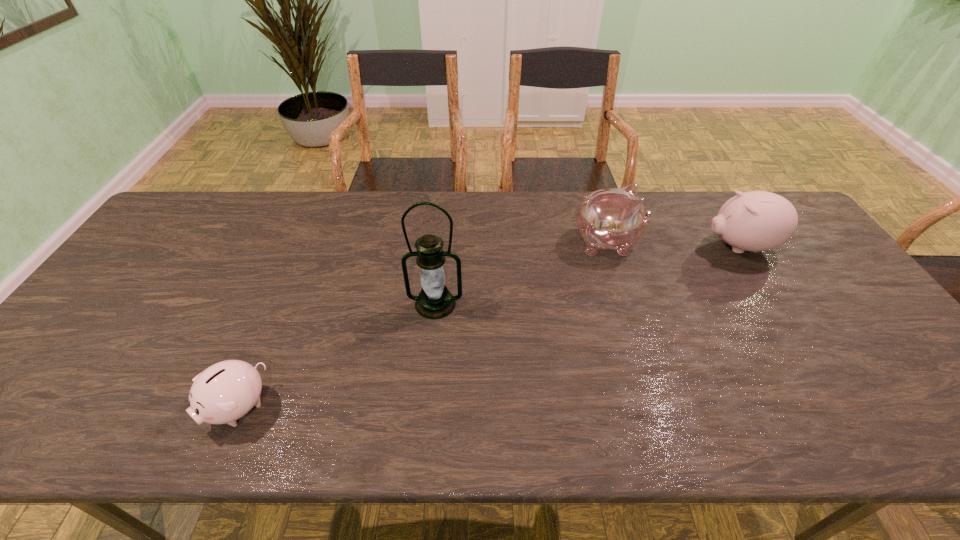
Locate an element on the screen. Image resolution: width=960 pixels, height=540 pixels. vacant point located between the rightmost piggy bank and the shortest object is located at coordinates (489, 327).

The image size is (960, 540). Identify the location of free area in between the nearest object and the rightmost object. (489, 327).

Identify the location of unoccupied position between the third object from right to left and the leftmost object. (337, 356).

Find the location of a particular element. This screenshot has width=960, height=540. free space between the second nearest object and the third object from left to right is located at coordinates (521, 273).

The height and width of the screenshot is (540, 960). I want to click on empty location between the third object from left to right and the leftmost object, so click(422, 325).

Identify the location of unoccupied area between the second nearest object and the rightmost piggy bank. (588, 275).

In order to click on empty space that is in between the rightmost piggy bank and the second object from left to right in this screenshot , I will do `click(588, 275)`.

Image resolution: width=960 pixels, height=540 pixels. In order to click on vacant area between the rightmost piggy bank and the shortest piggy bank in this screenshot , I will do `click(489, 327)`.

Find the location of a particular element. This screenshot has height=540, width=960. vacant region between the lantern and the leftmost piggy bank is located at coordinates (337, 356).

What are the coordinates of `object that ranks as the second closest to the second piggy bank from left to right` in the screenshot? It's located at (435, 301).